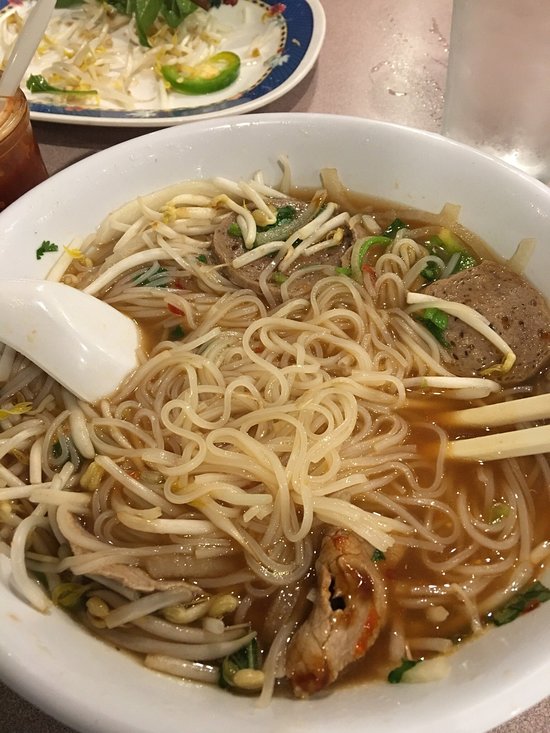
Where is `mostly empty plate`? This screenshot has height=733, width=550. mostly empty plate is located at coordinates (101, 48).